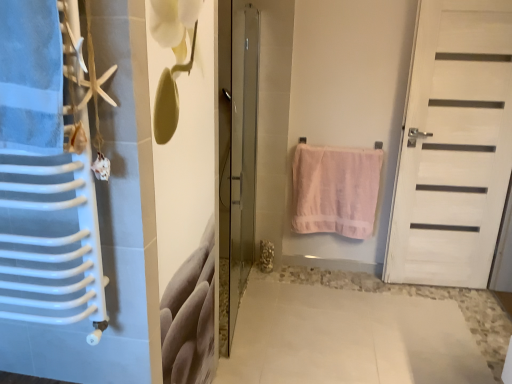
Question: Is white matte door at right, the 1th door in the right-to-left sequence, facing away from pink cotton towel at center?

Choices:
 (A) yes
 (B) no

Answer: (B)

Question: From the image's perspective, is white matte door at right, the 1th door in the right-to-left sequence, over pink cotton towel at center?

Choices:
 (A) no
 (B) yes

Answer: (B)

Question: Is white matte door at right, which appears as the 2th door when viewed from the left, completely or partially outside of pink cotton towel at center?

Choices:
 (A) yes
 (B) no

Answer: (A)

Question: Is white matte door at right, the 1th door in the right-to-left sequence, closer to camera compared to pink cotton towel at center?

Choices:
 (A) yes
 (B) no

Answer: (A)

Question: From a real-world perspective, is white matte door at right, the 1th door in the right-to-left sequence, below pink cotton towel at center?

Choices:
 (A) no
 (B) yes

Answer: (A)

Question: Could you tell me if white matte door at right, which appears as the 2th door when viewed from the left, is turned towards pink cotton towel at center?

Choices:
 (A) yes
 (B) no

Answer: (B)

Question: Is transparent glass door at center, the first door positioned from the left, to the left of pink cotton towel at center from the viewer's perspective?

Choices:
 (A) no
 (B) yes

Answer: (B)

Question: Is transparent glass door at center, marked as the second door in a right-to-left arrangement, closer to camera compared to pink cotton towel at center?

Choices:
 (A) no
 (B) yes

Answer: (B)

Question: Is transparent glass door at center, marked as the second door in a right-to-left arrangement, thinner than pink cotton towel at center?

Choices:
 (A) yes
 (B) no

Answer: (B)

Question: Is transparent glass door at center, the first door positioned from the left, not within pink cotton towel at center?

Choices:
 (A) no
 (B) yes

Answer: (B)

Question: Is pink cotton towel at center located within transparent glass door at center, the first door positioned from the left?

Choices:
 (A) yes
 (B) no

Answer: (B)

Question: Would you say white matte door at right, the 1th door in the right-to-left sequence, contains transparent glass door at center, the first door positioned from the left?

Choices:
 (A) no
 (B) yes

Answer: (A)